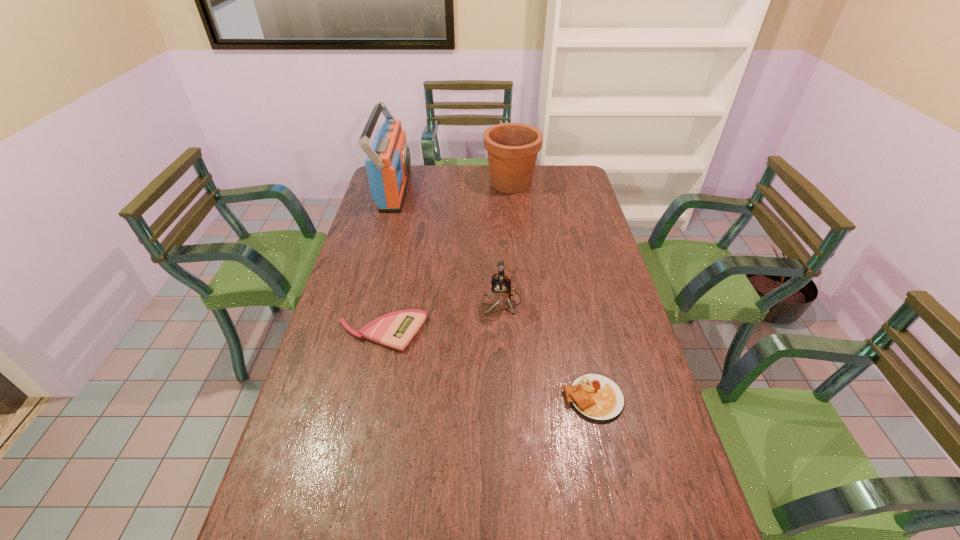
Locate an element on the screen. radio receiver is located at coordinates (388, 162).

This screenshot has height=540, width=960. Identify the location of the fourth shortest object. click(512, 148).

At what (x,y) coordinates should I click in order to perform the action: click on the third tallest object. Please return your answer as a coordinate pair (x, y). This screenshot has width=960, height=540. Looking at the image, I should click on (501, 286).

The width and height of the screenshot is (960, 540). Identify the location of earphone. (501, 286).

Find the location of `wristlet`. wristlet is located at coordinates (396, 329).

At what (x,y) coordinates should I click in order to perform the action: click on omelet. Please return your answer as a coordinate pair (x, y). Image resolution: width=960 pixels, height=540 pixels. Looking at the image, I should click on point(595,397).

Identify the location of vacant region located on the front-facing side of the tallest object. Image resolution: width=960 pixels, height=540 pixels. (475, 190).

Locate an element on the screen. The width and height of the screenshot is (960, 540). blank space located 0.290m on the front of the flowerpot is located at coordinates (516, 239).

Locate an element on the screen. The image size is (960, 540). vacant space positioned on the front of the third tallest object is located at coordinates (507, 377).

Find the location of a particular element. This screenshot has height=540, width=960. vacant position located 0.260m on the back of the wristlet is located at coordinates (396, 262).